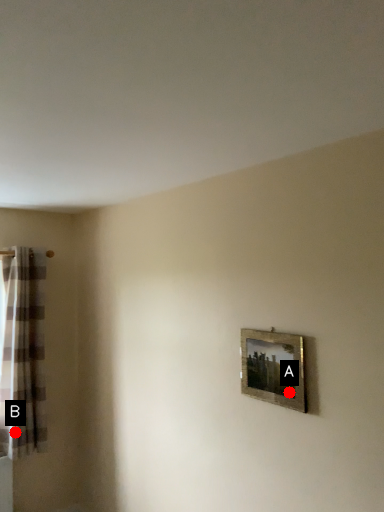
Question: Two points are circled on the image, labeled by A and B beside each circle. Which of the following is the farthest from the observer?

Choices:
 (A) A is further
 (B) B is further

Answer: (B)